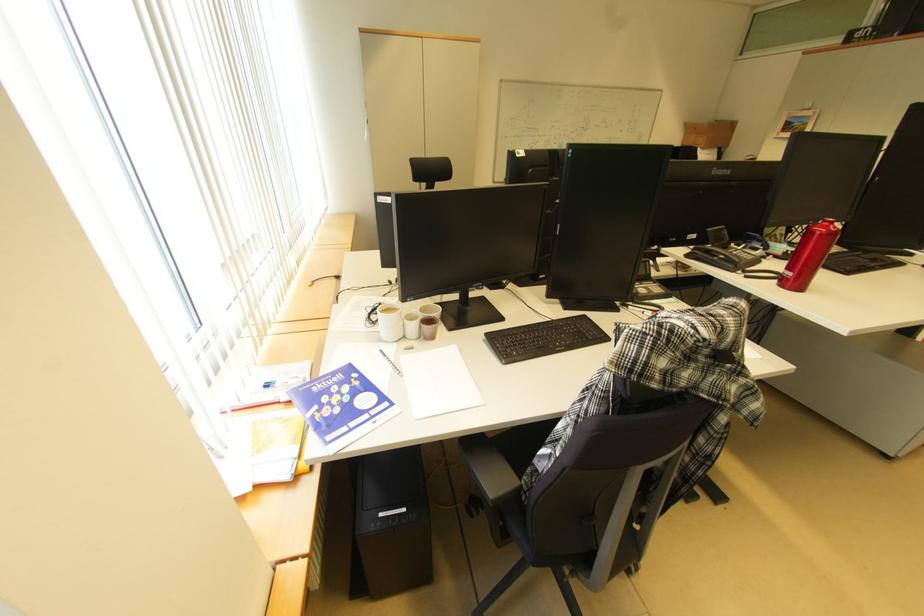
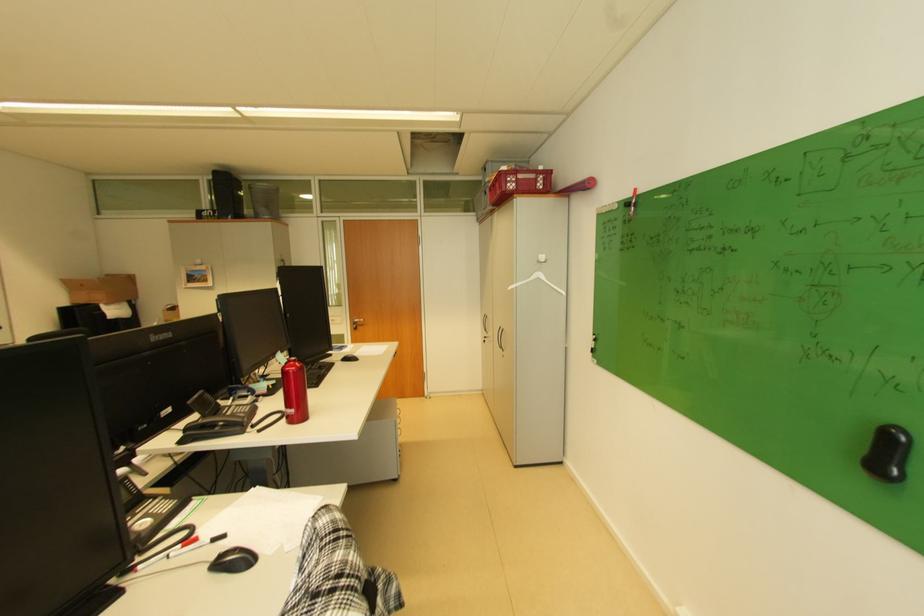
Question: The camera is either moving clockwise (left) or counter-clockwise (right) around the object. The first image is from the beginning of the video and the second image is from the end. Is the camera moving left or right when shooting the video?

Choices:
 (A) Left
 (B) Right

Answer: (A)